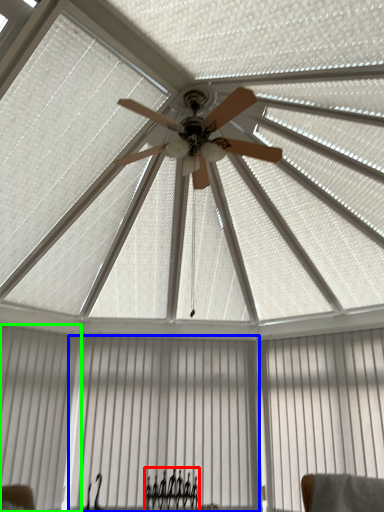
Question: Estimate the real-world distances between objects in this image. Which object is farther from furniture (highlighted by a red box), curtain (highlighted by a blue box) or shutter (highlighted by a green box)?

Choices:
 (A) curtain
 (B) shutter

Answer: (B)